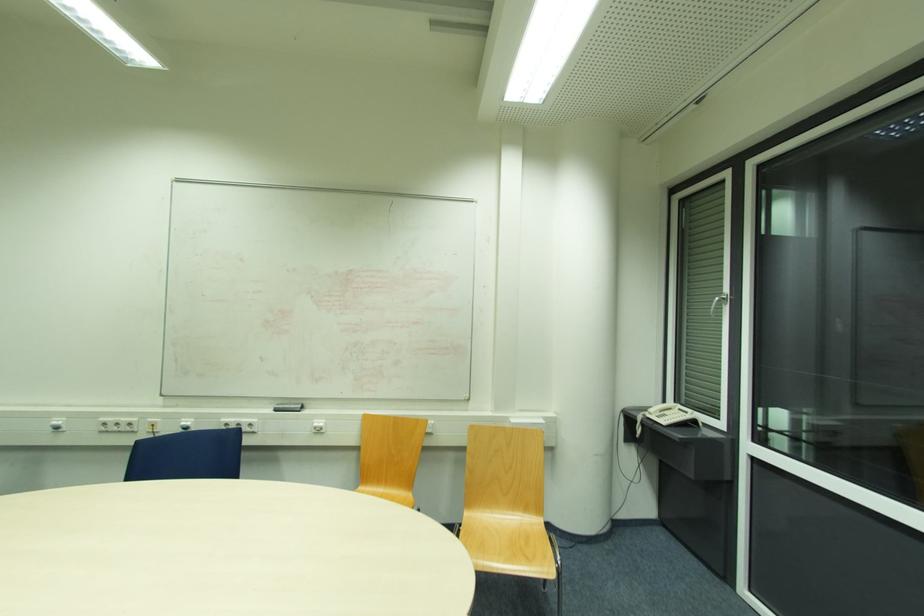
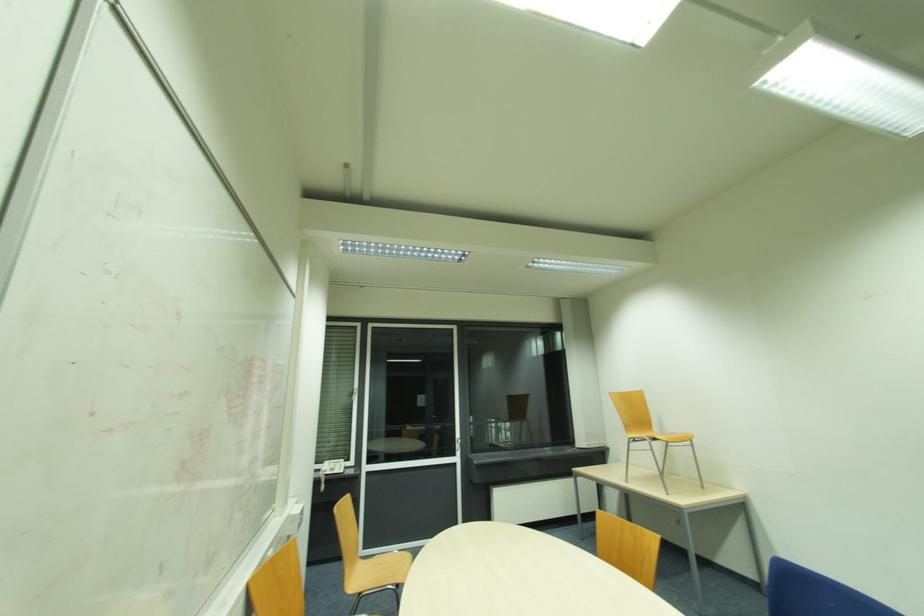
In the second image, find the point that corresponds to (x=682, y=410) in the first image.

(334, 463)